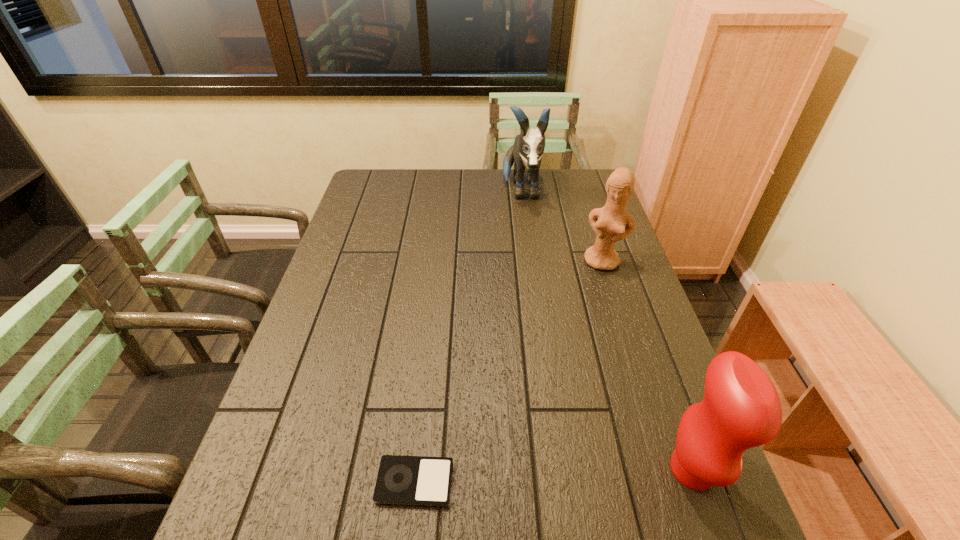
The height and width of the screenshot is (540, 960). I want to click on vacant area that lies between the figurine and the condiment, so click(x=648, y=366).

You are a GUI agent. You are given a task and a screenshot of the screen. Output one action in this format:
    pyautogui.click(x=<x>, y=<y>)
    Task: Click on the free space between the iPod and the farthest object
    The height and width of the screenshot is (540, 960).
    Given the screenshot: What is the action you would take?
    pyautogui.click(x=468, y=336)

You are a GUI agent. You are given a task and a screenshot of the screen. Output one action in this format:
    pyautogui.click(x=<x>, y=<y>)
    Task: Click on the vacant area that lies between the leftmost object and the second farthest object
    This screenshot has width=960, height=540.
    Given the screenshot: What is the action you would take?
    pyautogui.click(x=509, y=372)

Find the location of `vacant space in between the iPod and the third object from right to left`. vacant space in between the iPod and the third object from right to left is located at coordinates (468, 336).

The image size is (960, 540). I want to click on empty space that is in between the puppy and the third nearest object, so click(563, 226).

Locate an element on the screen. The width and height of the screenshot is (960, 540). vacant point located between the shortest object and the condiment is located at coordinates (554, 476).

Identify which object is the third nearest to the condiment. Please provide its 2D coordinates. Your answer should be formatted as a tuple, i.e. [(x, y)], where the tuple contains the x and y coordinates of a point satisfying the conditions above.

[(529, 145)]

Select which object is the closest to the condiment. Please provide its 2D coordinates. Your answer should be formatted as a tuple, i.e. [(x, y)], where the tuple contains the x and y coordinates of a point satisfying the conditions above.

[(402, 480)]

Image resolution: width=960 pixels, height=540 pixels. Find the location of `vacant space that satisfies the following two spatial constraints: 1. on the front side of the second farthest object; 2. on the right side of the farthest object`. vacant space that satisfies the following two spatial constraints: 1. on the front side of the second farthest object; 2. on the right side of the farthest object is located at coordinates (531, 261).

This screenshot has width=960, height=540. Find the location of `vacant region that satisfies the following two spatial constraints: 1. on the front side of the puppy; 2. on the label side of the condiment`. vacant region that satisfies the following two spatial constraints: 1. on the front side of the puppy; 2. on the label side of the condiment is located at coordinates (558, 469).